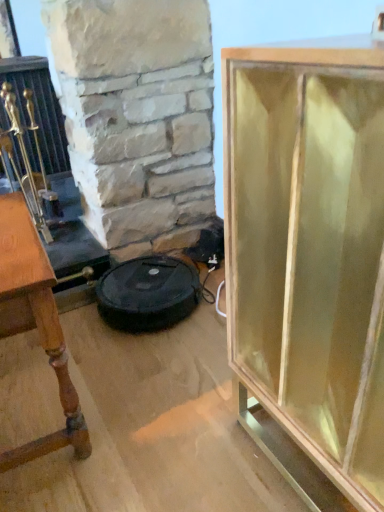
I want to click on vacant region below wooden table at left (from a real-world perspective), so click(x=28, y=397).